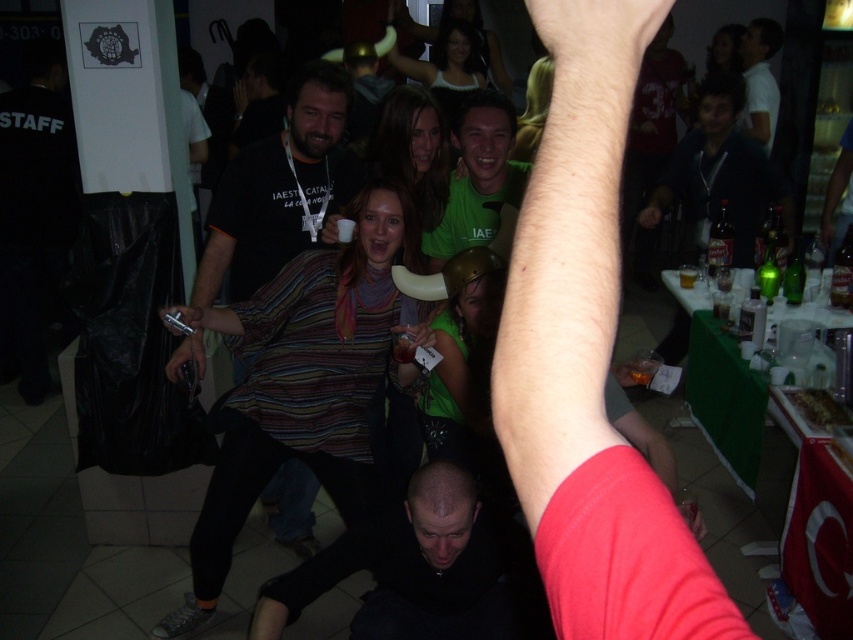
Between black matte shirt at lower center and dark blue hoodie at upper right, which one has less height?

Standing shorter between the two is black matte shirt at lower center.

Can you confirm if black matte shirt at lower center is positioned to the left of dark blue hoodie at upper right?

Correct, you'll find black matte shirt at lower center to the left of dark blue hoodie at upper right.

In order to click on black matte shirt at lower center in this screenshot , I will do `click(416, 570)`.

The height and width of the screenshot is (640, 853). Find the location of `black matte shirt at lower center`. black matte shirt at lower center is located at coordinates (416, 570).

Can you confirm if dark blue hoodie at upper right is positioned below green matte shirt at center?

No.

Is dark blue hoodie at upper right smaller than green matte shirt at center?

No, dark blue hoodie at upper right is not smaller than green matte shirt at center.

Is point (651, 227) positioned in front of point (477, 113)?

No, it is behind (477, 113).

Where is `dark blue hoodie at upper right`? dark blue hoodie at upper right is located at coordinates (721, 172).

Between dark blue hoodie at upper right and white matte shirt at upper right, which one has less height?

dark blue hoodie at upper right is shorter.

Does dark blue hoodie at upper right appear under white matte shirt at upper right?

Yes.

Which is in front, point (659, 179) or point (769, 83)?

Positioned in front is point (659, 179).

In order to click on dark blue hoodie at upper right in this screenshot , I will do `click(721, 172)`.